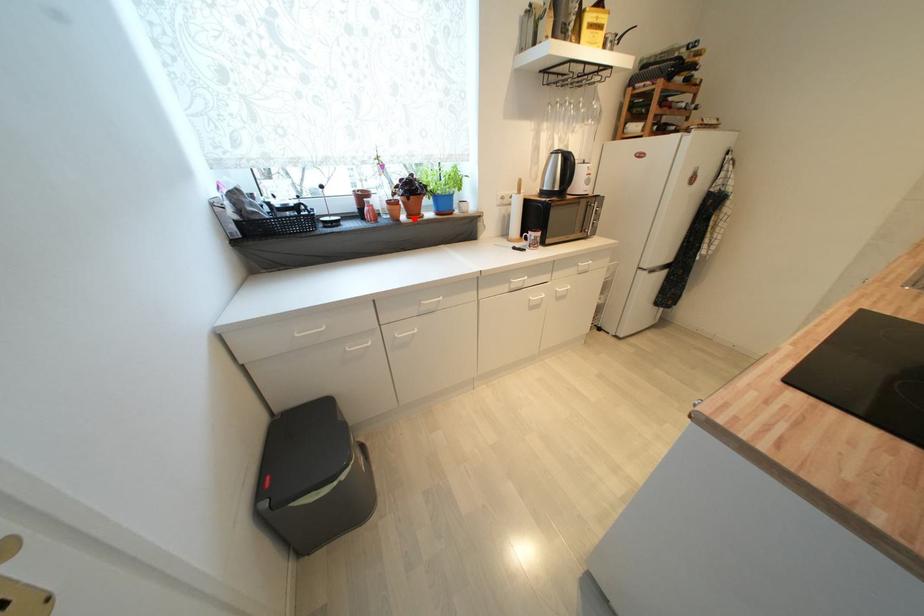
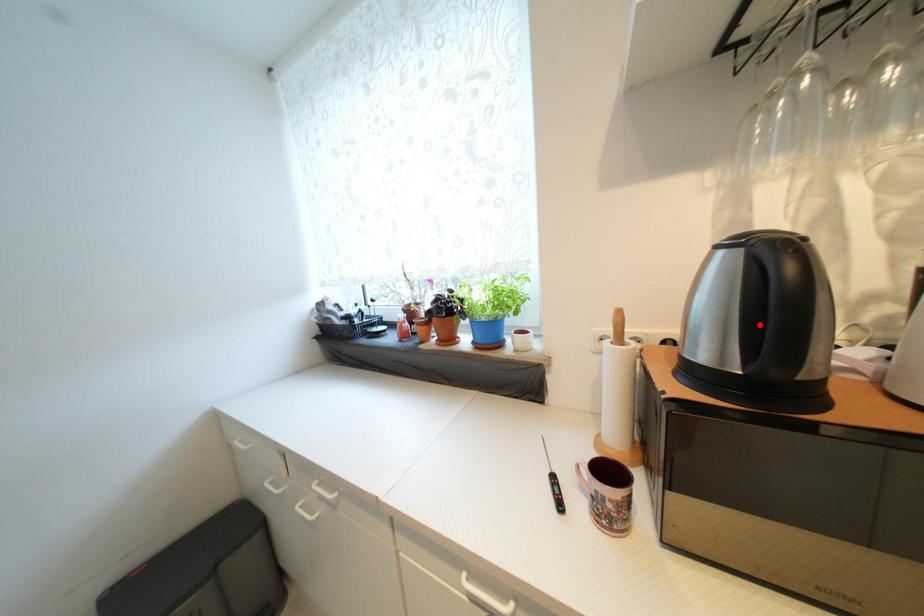
I am providing you with two images of the same scene from different viewpoints. A red point is marked on the first image and another point is marked on the second image. Is the marked point in image1 the same physical position as the marked point in image2?

No